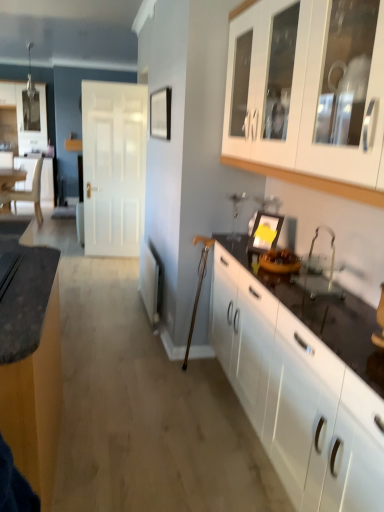
Question: Considering the positions of point (100, 204) and point (1, 168), is point (100, 204) closer or farther from the camera than point (1, 168)?

Choices:
 (A) farther
 (B) closer

Answer: (B)

Question: From a real-world perspective, is white matte door at center positioned above or below wooden table at left?

Choices:
 (A) above
 (B) below

Answer: (A)

Question: Which object is positioned farthest from the white glossy cabinets at right, which is the 2th cabinetry from right to left?

Choices:
 (A) white matte door at center
 (B) light beige wood chair at left
 (C) wooden table at left
 (D) clear glass sink at lower right
 (E) matte black countertop at left, which appears as the first cabinetry when viewed from the left

Answer: (C)

Question: Which object is positioned closest to the white glossy cabinet at upper right, the first cabinetry from the right?

Choices:
 (A) clear glass sink at lower right
 (B) matte black countertop at left, which is the 3th cabinetry from right to left
 (C) yellow paper at center
 (D) wooden table at left
 (E) light beige wood chair at left

Answer: (A)